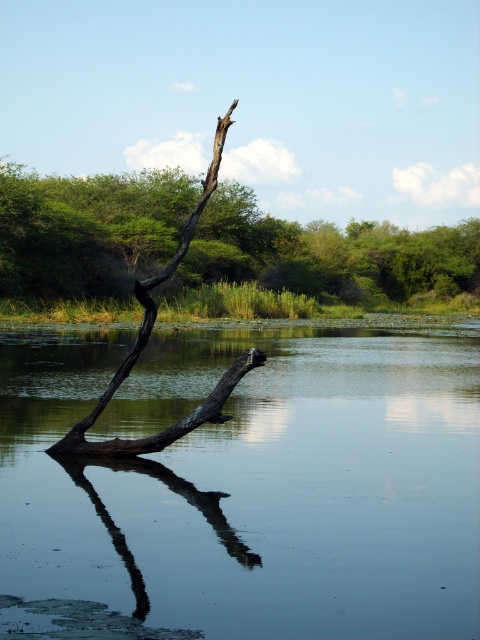
Question: Does smooth water at center have a greater width compared to dark brown wood at center?

Choices:
 (A) no
 (B) yes

Answer: (B)

Question: Does smooth water at center appear on the left side of brown rough tree trunk at center?

Choices:
 (A) no
 (B) yes

Answer: (B)

Question: Which is farther from the dark brown wood at center?

Choices:
 (A) smooth dark wood branch at lower center
 (B) smooth water at center

Answer: (A)

Question: Does brown rough tree trunk at center have a lesser width compared to dark brown wood at center?

Choices:
 (A) no
 (B) yes

Answer: (A)

Question: Which point is farther to the camera?

Choices:
 (A) dark brown wood at center
 (B) brown rough tree trunk at center
 (C) smooth water at center

Answer: (B)

Question: Among these objects, which one is nearest to the camera?

Choices:
 (A) dark brown wood at center
 (B) smooth water at center

Answer: (B)